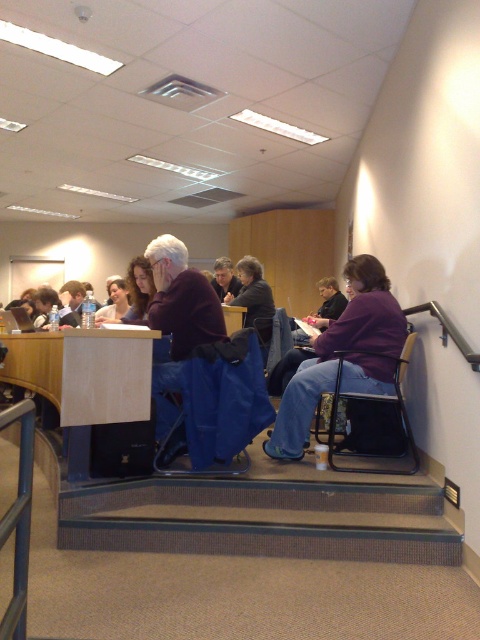
Measure the distance from blue fabric chair at lower center to metallic black chair at lower right.

A distance of 25.08 inches exists between blue fabric chair at lower center and metallic black chair at lower right.

Describe the element at coordinates (214, 404) in the screenshot. I see `blue fabric chair at lower center` at that location.

Image resolution: width=480 pixels, height=640 pixels. What are the coordinates of `blue fabric chair at lower center` in the screenshot? It's located at (214, 404).

Who is more distant from viewer, [120,406] or [263,362]?

The point [263,362] is more distant.

Which is behind, point (107, 417) or point (265, 349)?

Positioned behind is point (265, 349).

This screenshot has width=480, height=640. In order to click on light brown wood table at center in this screenshot , I will do `click(84, 380)`.

Which is in front, point (191, 397) or point (261, 342)?

Positioned in front is point (191, 397).

Identify the location of blue fabric chair at lower center. (214, 404).